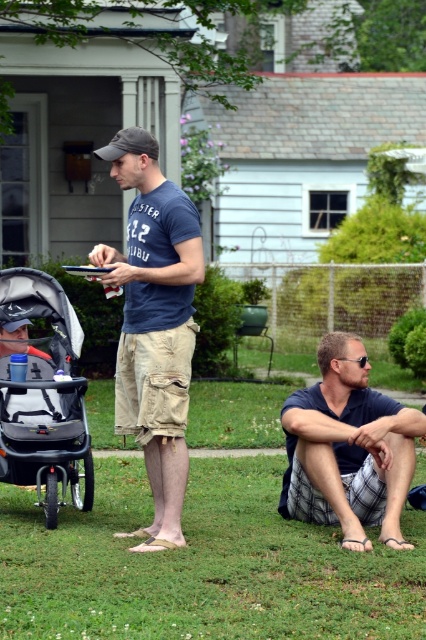
Is point (149, 410) positioned after point (23, 342)?

That is False.

Who is lower down, matte blue t-shirt at center or gray fabric stroller at left?

gray fabric stroller at left

Is point (181, 336) behind point (71, 330)?

No, (181, 336) is closer to viewer.

You are a GUI agent. You are given a task and a screenshot of the screen. Output one action in this format:
    pyautogui.click(x=<x>, y=<y>)
    Task: Click on the matte blue t-shirt at center
    This screenshot has height=640, width=426.
    Given the screenshot: What is the action you would take?
    pyautogui.click(x=154, y=324)

Does point (348, 381) come behind point (9, 387)?

No, it is in front of (9, 387).

Can you confirm if dark blue shirt at lower right is taller than gray fabric stroller at left?

No, dark blue shirt at lower right is not taller than gray fabric stroller at left.

Is point (411, 422) farther from viewer compared to point (55, 428)?

No, (411, 422) is closer to viewer.

Locate an element on the screen. dark blue shirt at lower right is located at coordinates (348, 449).

Does dark blue shirt at lower right have a greater width compared to matte gray baseball cap at center?

In fact, dark blue shirt at lower right might be narrower than matte gray baseball cap at center.

Between dark blue shirt at lower right and matte gray baseball cap at center, which one has less height?

dark blue shirt at lower right

Which is in front, point (327, 349) or point (137, 125)?

Point (327, 349)

The height and width of the screenshot is (640, 426). I want to click on dark blue shirt at lower right, so click(348, 449).